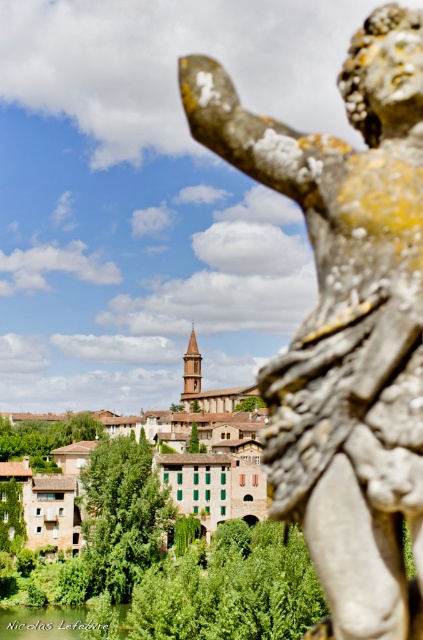
Question: Considering the relative positions of brown stone buildings at center and green leafy river at lower left in the image provided, where is brown stone buildings at center located with respect to green leafy river at lower left?

Choices:
 (A) above
 (B) below

Answer: (A)

Question: Estimate the real-world distances between objects in this image. Which object is closer to the brown stone buildings at center?

Choices:
 (A) green leafy river at lower left
 (B) bronze statue at upper right

Answer: (A)

Question: Which object is closer to the camera taking this photo?

Choices:
 (A) brown stone buildings at center
 (B) green leafy river at lower left
 (C) bronze statue at upper right

Answer: (C)

Question: Is brown stone buildings at center smaller than green leafy river at lower left?

Choices:
 (A) yes
 (B) no

Answer: (B)

Question: Which point is farther to the camera?

Choices:
 (A) brown stone buildings at center
 (B) green leafy river at lower left
 (C) bronze statue at upper right

Answer: (A)

Question: Does bronze statue at upper right come behind brown stone buildings at center?

Choices:
 (A) no
 (B) yes

Answer: (A)